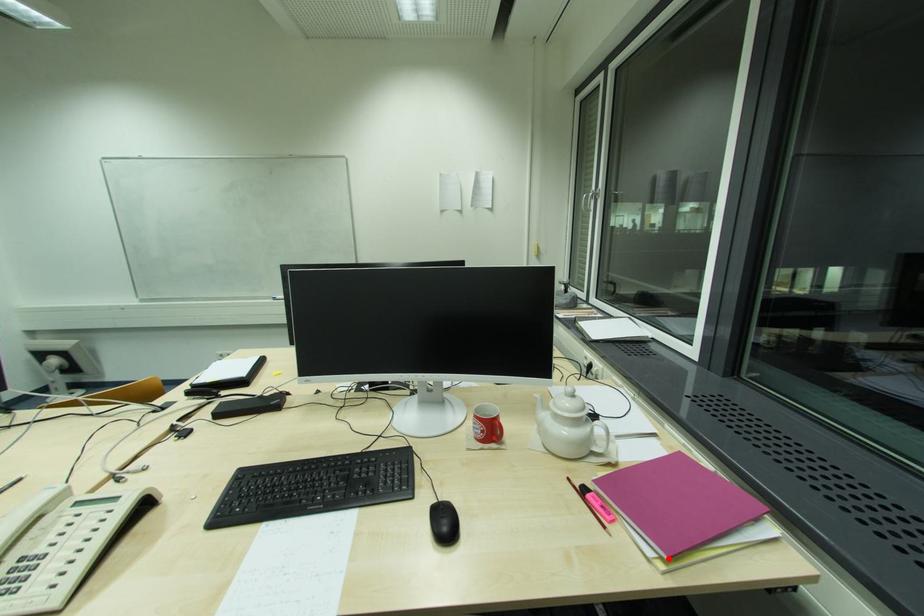
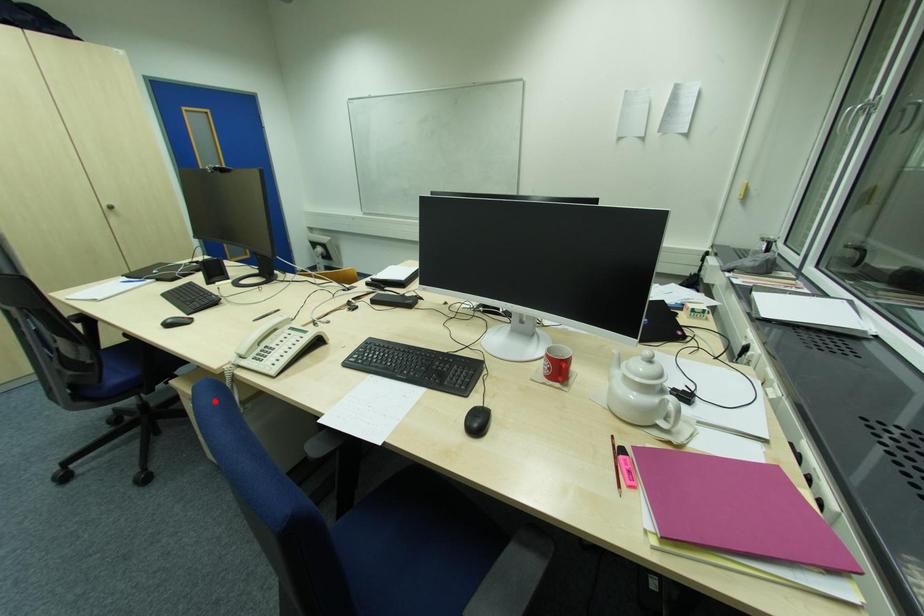
I am providing you with two images of the same scene from different viewpoints. A red point is marked on the first image and another point is marked on the second image. Does the point marked in image1 correspond to the same location as the one in image2?

No